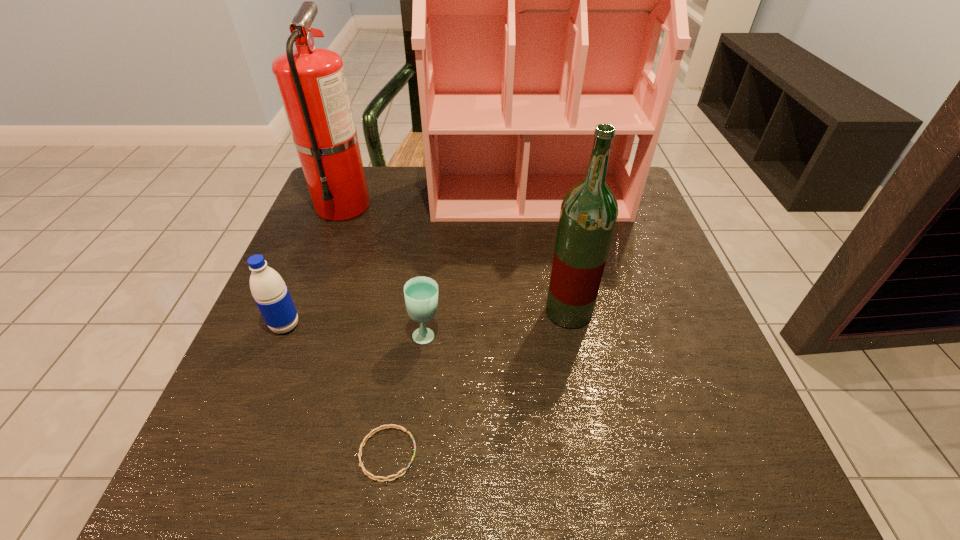
Where is `object located in the far right corner section of the desktop`? The image size is (960, 540). object located in the far right corner section of the desktop is located at coordinates (538, 0).

Identify the location of vacant space at the left edge of the desktop. (225, 408).

The width and height of the screenshot is (960, 540). In the image, there is a desktop. In order to click on vacant area at the right edge in this screenshot , I will do `click(621, 225)`.

Image resolution: width=960 pixels, height=540 pixels. In the image, there is a desktop. What are the coordinates of `vacant space at the far left corner` in the screenshot? It's located at (373, 197).

Locate an element on the screen. The width and height of the screenshot is (960, 540). vacant region at the near right corner of the desktop is located at coordinates (679, 488).

Where is `empty space that is in between the shortest object and the dollhouse`? The image size is (960, 540). empty space that is in between the shortest object and the dollhouse is located at coordinates (458, 325).

In order to click on vacant space that is in between the fifth tallest object and the dollhouse in this screenshot , I will do `click(478, 266)`.

In order to click on vacant space that's between the fifth tallest object and the liquor in this screenshot , I will do `click(497, 323)`.

At what (x,y) coordinates should I click in order to perform the action: click on vacant space in between the fire extinguisher and the glass. Please return your answer as a coordinate pair (x, y). Looking at the image, I should click on (385, 270).

I want to click on free spot between the third shortest object and the dollhouse, so click(407, 261).